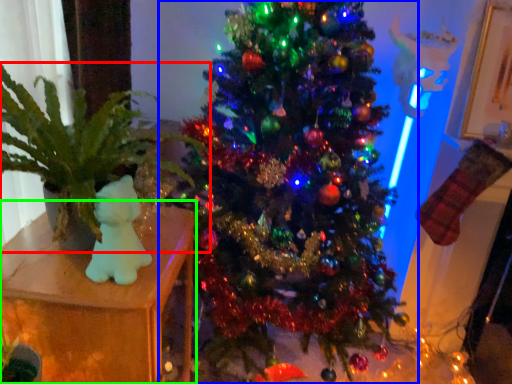
Question: Based on their relative distances, which object is farther from houseplant (highlighted by a red box)? Choose from christmas tree (highlighted by a blue box) and furniture (highlighted by a green box).

Choices:
 (A) christmas tree
 (B) furniture

Answer: (A)